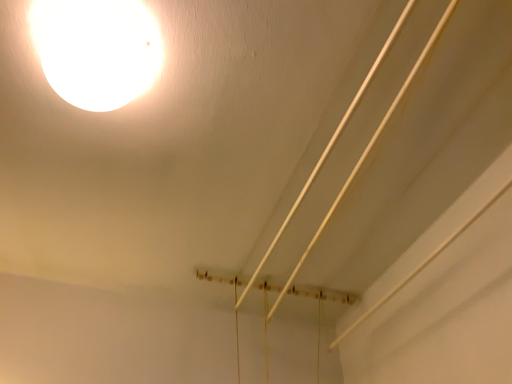
What is the approximate height of white glossy lampshade at upper left?

white glossy lampshade at upper left is 4.20 inches in height.

What do you see at coordinates (97, 50) in the screenshot? The image size is (512, 384). I see `white glossy lampshade at upper left` at bounding box center [97, 50].

At what (x,y) coordinates should I click in order to perform the action: click on white glossy lampshade at upper left. Please return your answer as a coordinate pair (x, y). The image size is (512, 384). Looking at the image, I should click on (97, 50).

This screenshot has width=512, height=384. I want to click on white glossy lampshade at upper left, so click(x=97, y=50).